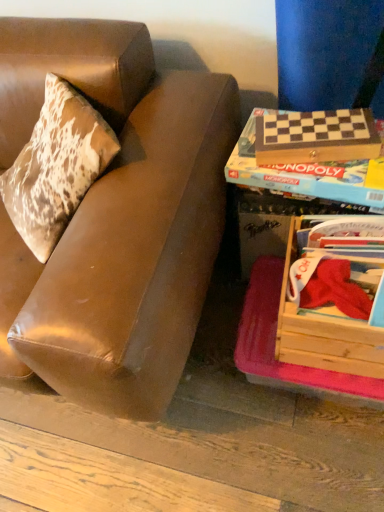
Locate an element on the screen. This screenshot has width=384, height=512. wooden checkered board at right, placed as the 1th paperback book when sorted from bottom to top is located at coordinates (308, 165).

Describe the element at coordinates (316, 137) in the screenshot. I see `wooden checkered board at right, which is the 2th paperback book from bottom to top` at that location.

What do you see at coordinates (325, 333) in the screenshot? This screenshot has height=512, width=384. I see `wooden crate at lower right` at bounding box center [325, 333].

I want to click on brown leather couch at left, so click(x=116, y=218).

Where is `storage box below the wooden checkered board at right, the second paperback book in the top-to-bottom sequence (from a real-world perspective)`? storage box below the wooden checkered board at right, the second paperback book in the top-to-bottom sequence (from a real-world perspective) is located at coordinates (273, 222).

Based on the photo, in terms of height, does wooden checkered board at right, the second paperback book in the top-to-bottom sequence, look taller or shorter compared to wooden monopoly box at right?

Clearly, wooden checkered board at right, the second paperback book in the top-to-bottom sequence, is shorter compared to wooden monopoly box at right.

From the picture: Does wooden checkered board at right, the second paperback book in the top-to-bottom sequence, have a greater width compared to wooden monopoly box at right?

Correct, the width of wooden checkered board at right, the second paperback book in the top-to-bottom sequence, exceeds that of wooden monopoly box at right.

Which is more to the left, wooden checkered board at right, the second paperback book in the top-to-bottom sequence, or wooden checkered board at right, which is the 2th paperback book from bottom to top?

Positioned to the left is wooden checkered board at right, which is the 2th paperback book from bottom to top.

Is wooden checkered board at right, placed as the 1th paperback book when sorted from bottom to top, inside or outside of wooden checkered board at right, which is the 2th paperback book from bottom to top?

wooden checkered board at right, placed as the 1th paperback book when sorted from bottom to top, is outside wooden checkered board at right, which is the 2th paperback book from bottom to top.

Are wooden checkered board at right, placed as the 1th paperback book when sorted from bottom to top, and wooden checkered board at right, which is the 2th paperback book from bottom to top, making contact?

Indeed, wooden checkered board at right, placed as the 1th paperback book when sorted from bottom to top, and wooden checkered board at right, which is the 2th paperback book from bottom to top, are beside each other and touching.

Based on the photo, considering the sizes of objects wooden checkered board at right, the second paperback book in the top-to-bottom sequence, and wooden checkered board at right, the first paperback book positioned from the top, in the image provided, who is bigger, wooden checkered board at right, the second paperback book in the top-to-bottom sequence, or wooden checkered board at right, the first paperback book positioned from the top,?

With larger size is wooden checkered board at right, the second paperback book in the top-to-bottom sequence.

Where is `box lying in front of the wooden checkered board at right, the first paperback book positioned from the top`? The height and width of the screenshot is (512, 384). box lying in front of the wooden checkered board at right, the first paperback book positioned from the top is located at coordinates (325, 333).

Does point (260, 129) come closer to viewer compared to point (329, 357)?

No.

Is the surface of wooden checkered board at right, which is the 2th paperback book from bottom to top, in direct contact with wooden crate at lower right?

No, wooden checkered board at right, which is the 2th paperback book from bottom to top, is not touching wooden crate at lower right.

From the image's perspective, who appears lower, wooden crate at lower right or wooden checkered board at right, which is the 2th paperback book from bottom to top?

wooden crate at lower right appears lower in the image.

Would you say wooden crate at lower right contains wooden checkered board at right, the first paperback book positioned from the top?

Actually, wooden checkered board at right, the first paperback book positioned from the top, is outside wooden crate at lower right.

What's the angular difference between wooden crate at lower right and wooden checkered board at right, the first paperback book positioned from the top,'s facing directions?

8.47 degrees.

Between point (291, 328) and point (337, 126), which one is positioned in front?

The point (291, 328) is closer to the camera.

Considering the sizes of objects wooden checkered board at right, which is the 2th paperback book from bottom to top, and wooden monopoly box at right in the image provided, who is thinner, wooden checkered board at right, which is the 2th paperback book from bottom to top, or wooden monopoly box at right?

wooden checkered board at right, which is the 2th paperback book from bottom to top, is thinner.

Is wooden checkered board at right, which is the 2th paperback book from bottom to top, not within wooden monopoly box at right?

Yes, wooden checkered board at right, which is the 2th paperback book from bottom to top, is located beyond the bounds of wooden monopoly box at right.

Looking at the image, does wooden checkered board at right, which is the 2th paperback book from bottom to top, seem bigger or smaller compared to wooden monopoly box at right?

Considering their sizes, wooden checkered board at right, which is the 2th paperback book from bottom to top, takes up less space than wooden monopoly box at right.

From the image's perspective, which one is positioned lower, wooden checkered board at right, the first paperback book positioned from the top, or wooden monopoly box at right?

From the image's view, wooden monopoly box at right is below.

Relative to brown leather couch at left, is wooden crate at lower right in front or behind?

wooden crate at lower right is behind brown leather couch at left.

In the scene shown: Based on their positions, is wooden crate at lower right located to the left or right of brown leather couch at left?

From the image, it's evident that wooden crate at lower right is to the right of brown leather couch at left.

What's the angular difference between wooden crate at lower right and brown leather couch at left's facing directions?

They differ by 1.52 degrees in their facing directions.

Consider the image. Considering the relative sizes of wooden monopoly box at right and brown leather couch at left in the image provided, is wooden monopoly box at right taller than brown leather couch at left?

In fact, wooden monopoly box at right may be shorter than brown leather couch at left.

From the image's perspective, which one is positioned higher, wooden monopoly box at right or brown leather couch at left?

wooden monopoly box at right, from the image's perspective.

Is wooden monopoly box at right positioned in front of brown leather couch at left?

No, wooden monopoly box at right is further to the viewer.

The height and width of the screenshot is (512, 384). Identify the location of studio couch below the wooden monopoly box at right (from the image's perspective). (116, 218).

Where is `storage box that is on the right side of wooden checkered board at right, placed as the 1th paperback book when sorted from bottom to top`? storage box that is on the right side of wooden checkered board at right, placed as the 1th paperback book when sorted from bottom to top is located at coordinates (x=273, y=222).

What are the coordinates of `paperback book located underneath the wooden checkered board at right, the first paperback book positioned from the top (from a real-world perspective)` in the screenshot? It's located at (308, 165).

From the image, which object appears to be farther from wooden monopoly box at right, wooden checkered board at right, the second paperback book in the top-to-bottom sequence, or brown leather couch at left?

brown leather couch at left lies further to wooden monopoly box at right than the other object.

From the image, which object appears to be farther from brown leather couch at left, wooden crate at lower right or wooden checkered board at right, the first paperback book positioned from the top?

The object further to brown leather couch at left is wooden crate at lower right.

Based on their spatial positions, is brown leather couch at left or wooden crate at lower right further from wooden checkered board at right, which is the 2th paperback book from bottom to top?

brown leather couch at left is positioned further to the anchor wooden checkered board at right, which is the 2th paperback book from bottom to top.

Estimate the real-world distances between objects in this image. Which object is closer to wooden checkered board at right, which is the 2th paperback book from bottom to top, brown leather couch at left or wooden checkered board at right, the second paperback book in the top-to-bottom sequence?

Based on the image, wooden checkered board at right, the second paperback book in the top-to-bottom sequence, appears to be nearer to wooden checkered board at right, which is the 2th paperback book from bottom to top.

Estimate the real-world distances between objects in this image. Which object is closer to wooden checkered board at right, the second paperback book in the top-to-bottom sequence, wooden monopoly box at right or brown leather couch at left?

The object closer to wooden checkered board at right, the second paperback book in the top-to-bottom sequence, is wooden monopoly box at right.

From the image, which object appears to be farther from brown leather couch at left, wooden crate at lower right or wooden monopoly box at right?

Among the two, wooden crate at lower right is located further to brown leather couch at left.

Considering their positions, is wooden crate at lower right positioned further to wooden checkered board at right, the second paperback book in the top-to-bottom sequence, than brown leather couch at left?

The object further to wooden checkered board at right, the second paperback book in the top-to-bottom sequence, is brown leather couch at left.

When comparing their distances from wooden checkered board at right, the first paperback book positioned from the top, does wooden checkered board at right, the second paperback book in the top-to-bottom sequence, or brown leather couch at left seem closer?

wooden checkered board at right, the second paperback book in the top-to-bottom sequence, lies closer to wooden checkered board at right, the first paperback book positioned from the top, than the other object.

Locate an element on the screen. This screenshot has width=384, height=512. paperback book between brown leather couch at left and wooden checkered board at right, placed as the 1th paperback book when sorted from bottom to top, in the horizontal direction is located at coordinates (316, 137).

Identify the location of paperback book between wooden checkered board at right, the first paperback book positioned from the top, and wooden monopoly box at right vertically. (308, 165).

I want to click on storage box that lies between wooden checkered board at right, placed as the 1th paperback book when sorted from bottom to top, and wooden crate at lower right from top to bottom, so click(x=273, y=222).

The height and width of the screenshot is (512, 384). I want to click on storage box situated between brown leather couch at left and wooden crate at lower right from left to right, so click(273, 222).